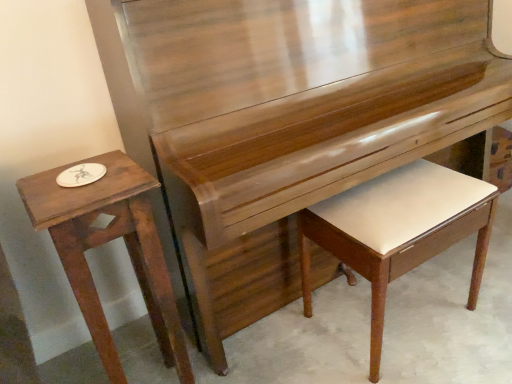
This screenshot has width=512, height=384. Describe the element at coordinates (398, 230) in the screenshot. I see `white leather music stool at lower right` at that location.

The image size is (512, 384). I want to click on white leather music stool at lower right, so pyautogui.click(x=398, y=230).

Where is `wooden table at left`? The width and height of the screenshot is (512, 384). wooden table at left is located at coordinates (106, 242).

What do you see at coordinates (106, 242) in the screenshot? The width and height of the screenshot is (512, 384). I see `wooden table at left` at bounding box center [106, 242].

Find the location of `white leather music stool at lower right`. white leather music stool at lower right is located at coordinates (398, 230).

Which object is positioned more to the right, wooden table at left or white leather music stool at lower right?

white leather music stool at lower right is more to the right.

Considering the relative positions of wooden table at left and white leather music stool at lower right in the image provided, is wooden table at left in front of white leather music stool at lower right?

Yes, wooden table at left is in front of white leather music stool at lower right.

Does point (177, 314) come behind point (381, 211)?

Yes.

From the image's perspective, is wooden table at left located above white leather music stool at lower right?

No, from the image's perspective, wooden table at left is not over white leather music stool at lower right.

From a real-world perspective, between wooden table at left and white leather music stool at lower right, who is vertically lower?

In real-world perspective, white leather music stool at lower right is lower.

Is wooden table at left wider than white leather music stool at lower right?

Incorrect, the width of wooden table at left does not surpass that of white leather music stool at lower right.

From the picture: Which of these two, wooden table at left or white leather music stool at lower right, stands taller?

Standing taller between the two is wooden table at left.

Considering the relative sizes of wooden table at left and white leather music stool at lower right in the image provided, is wooden table at left bigger than white leather music stool at lower right?

→ No.

Can white leather music stool at lower right be found inside wooden table at left?

That's incorrect, white leather music stool at lower right is not inside wooden table at left.

Is the surface of wooden table at left in direct contact with white leather music stool at lower right?

They are not placed beside each other.

Consider the image. Is wooden table at left turned away from white leather music stool at lower right?

wooden table at left does not have its back to white leather music stool at lower right.

What's the angular difference between wooden table at left and white leather music stool at lower right's facing directions?

They differ by 1.86 degrees in their facing directions.

Where is `music stool directly beneath the wooden table at left (from a real-world perspective)`? music stool directly beneath the wooden table at left (from a real-world perspective) is located at coordinates (398, 230).

Is white leather music stool at lower right to the right of wooden table at left from the viewer's perspective?

Yes, white leather music stool at lower right is to the right of wooden table at left.

Relative to wooden table at left, is white leather music stool at lower right in front or behind?

white leather music stool at lower right is positioned farther from the viewer than wooden table at left.

Considering the points (352, 208) and (27, 190), which point is in front, point (352, 208) or point (27, 190)?

Point (27, 190)

In the scene shown: From the image's perspective, is white leather music stool at lower right located above wooden table at left?

Yes, from the image's perspective, white leather music stool at lower right is above wooden table at left.

From a real-world perspective, is white leather music stool at lower right physically located above or below wooden table at left?

white leather music stool at lower right is situated lower than wooden table at left in the real world.

Is white leather music stool at lower right thinner than wooden table at left?

In fact, white leather music stool at lower right might be wider than wooden table at left.

Is white leather music stool at lower right taller or shorter than wooden table at left?

In the image, white leather music stool at lower right appears to be shorter than wooden table at left.

Considering the sizes of white leather music stool at lower right and wooden table at left in the image, is white leather music stool at lower right bigger or smaller than wooden table at left?

In the image, white leather music stool at lower right appears to be larger than wooden table at left.

Is white leather music stool at lower right not inside wooden table at left?

Yes, white leather music stool at lower right is not within wooden table at left.

Are white leather music stool at lower right and wooden table at left far apart?

No, white leather music stool at lower right is not far from wooden table at left.

Is white leather music stool at lower right turned away from wooden table at left?

No, white leather music stool at lower right is not facing away from wooden table at left.

How distant is white leather music stool at lower right from wooden table at left?

A distance of 24.71 inches exists between white leather music stool at lower right and wooden table at left.

In the image, there is a wooden table at left. Identify the location of music stool above it (from the image's perspective). The height and width of the screenshot is (384, 512). pyautogui.click(x=398, y=230).

Identify the location of music stool on the right of wooden table at left. The image size is (512, 384). (398, 230).

Locate an element on the screen. Image resolution: width=512 pixels, height=384 pixels. music stool located behind the wooden table at left is located at coordinates [x=398, y=230].